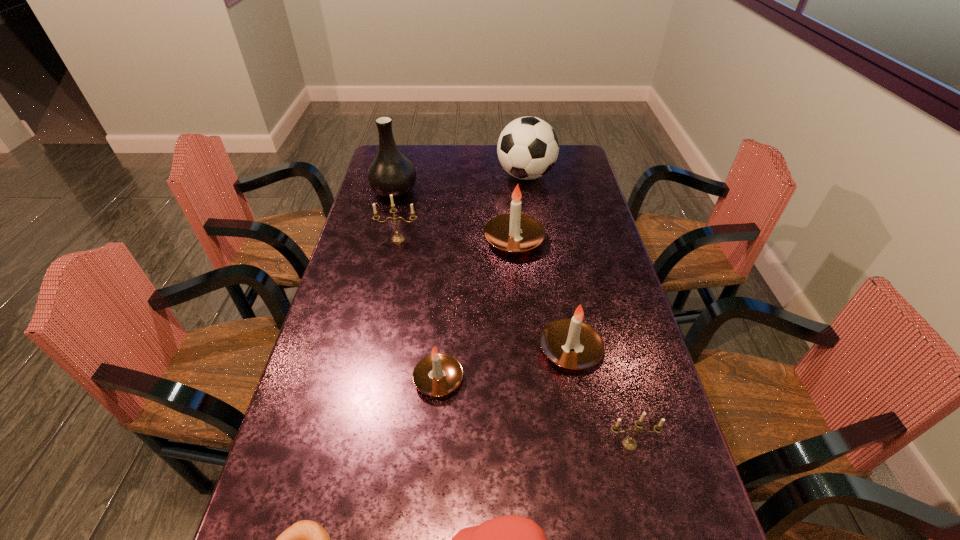
Select which object is the third closest to the shortest object. Please provide its 2D coordinates. Your answer should be formatted as a tuple, i.e. [(x, y)], where the tuple contains the x and y coordinates of a point satisfying the conditions above.

[(570, 343)]

I want to click on object that stands as the sixth closest to the cap, so click(397, 238).

The image size is (960, 540). Find the location of `candle that is the fourth nearest to the smaller metallic candle`. candle that is the fourth nearest to the smaller metallic candle is located at coordinates (397, 238).

Locate an element on the screen. candle that is the fourth nearest to the tallest candle is located at coordinates (629, 443).

Identify which white candle is located as the third nearest to the soccer ball. Please provide its 2D coordinates. Your answer should be formatted as a tuple, i.e. [(x, y)], where the tuple contains the x and y coordinates of a point satisfying the conditions above.

[(438, 374)]

Identify the location of white candle that is the nearest to the second shortest object. The image size is (960, 540). (438, 374).

You are a GUI agent. You are given a task and a screenshot of the screen. Output one action in this format:
    pyautogui.click(x=<x>, y=<y>)
    Task: Click on the free space that satisfies the following two spatial constraints: 1. on the back side of the soccer ball; 2. on the left side of the vase
    This screenshot has height=540, width=960.
    Given the screenshot: What is the action you would take?
    pyautogui.click(x=398, y=176)